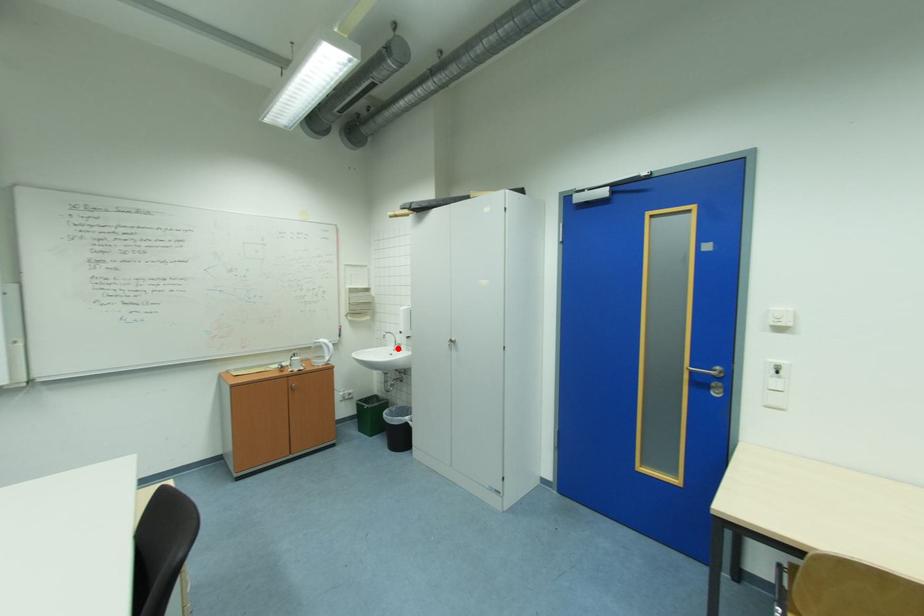
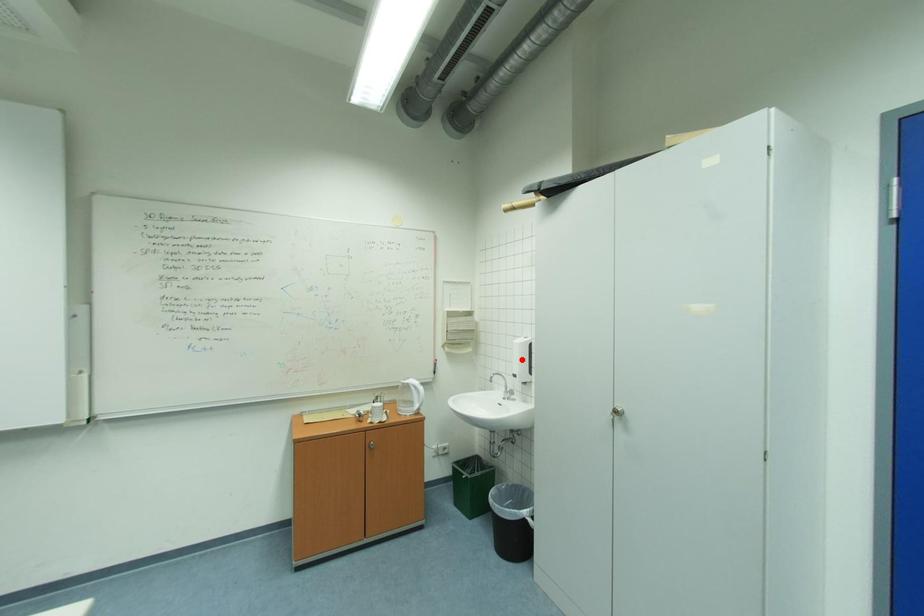
I am providing you with two images of the same scene from different viewpoints. A red point is marked on the first image and another point is marked on the second image. Do the highlighted points in image1 and image2 indicate the same real-world spot?

No